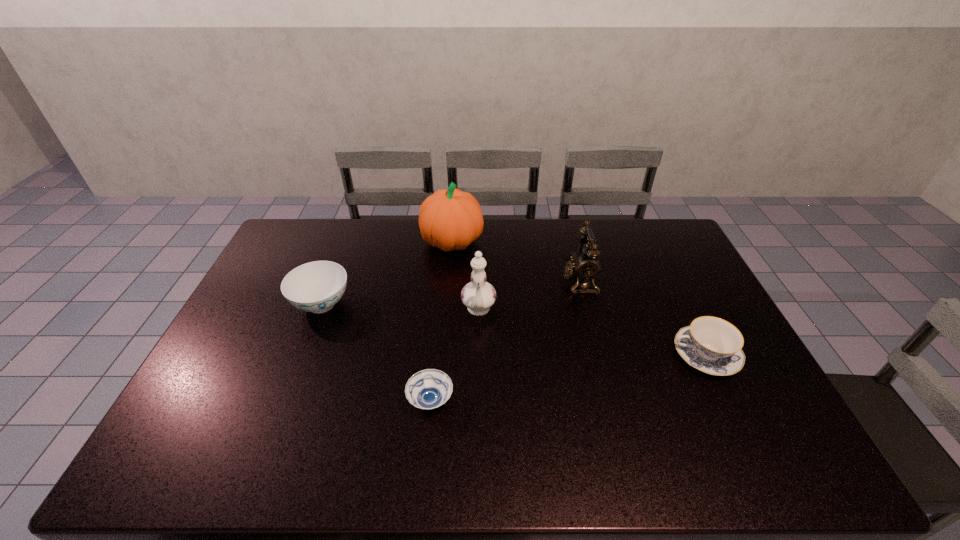
At what (x,y) coordinates should I click in order to perform the action: click on unoccupied position between the farthest object and the soup bowl. Please return your answer as a coordinate pair (x, y). This screenshot has width=960, height=540. Looking at the image, I should click on (442, 321).

This screenshot has height=540, width=960. Find the location of `vacant space that's between the soup bowl and the rightmost object`. vacant space that's between the soup bowl and the rightmost object is located at coordinates (567, 378).

At what (x,y) coordinates should I click in order to perform the action: click on free spot between the tallest chinaware and the leftmost object. Please return your answer as a coordinate pair (x, y). The height and width of the screenshot is (540, 960). Looking at the image, I should click on [x=400, y=307].

Find the location of a particular element. vacant area that lies between the soup bowl and the farthest object is located at coordinates (442, 321).

What are the coordinates of `vacant point located between the pumpkin and the telephone` in the screenshot? It's located at (516, 261).

This screenshot has height=540, width=960. I want to click on the third closest object relative to the soup bowl, so click(585, 265).

Identify the location of object that is the fifth closest to the pumpkin. (712, 345).

This screenshot has width=960, height=540. I want to click on the closest chinaware to the soup bowl, so click(x=478, y=296).

Select which chinaware appears as the second closest to the tallest chinaware. Please provide its 2D coordinates. Your answer should be formatted as a tuple, i.e. [(x, y)], where the tuple contains the x and y coordinates of a point satisfying the conditions above.

[(712, 345)]

Where is `vacant space that satisfies the following two spatial constraints: 1. at the spout of the tallest chinaware; 2. with the handle on the side of the rightmost object`? This screenshot has height=540, width=960. vacant space that satisfies the following two spatial constraints: 1. at the spout of the tallest chinaware; 2. with the handle on the side of the rightmost object is located at coordinates (478, 355).